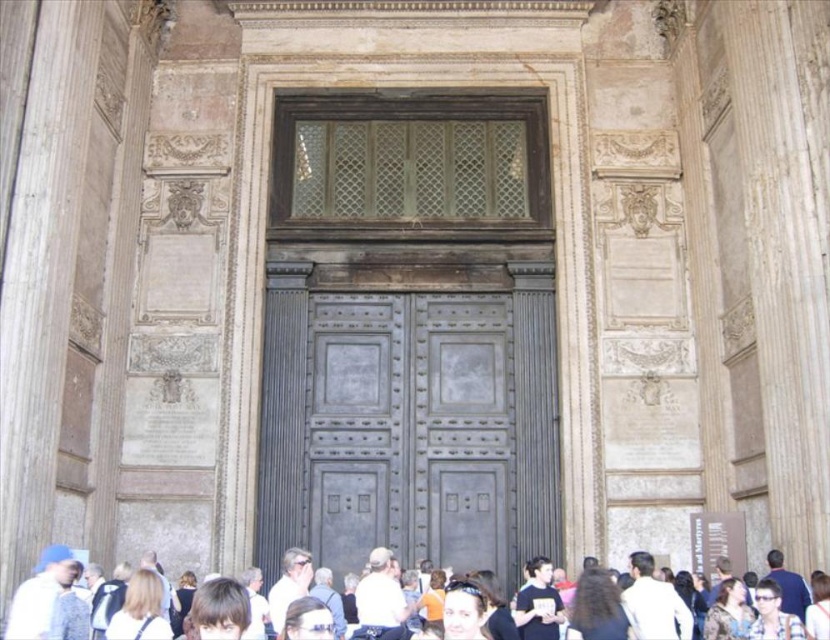
You are standing at the entrance of this historical building and notice a person wearing white casual clothing at lower center and someone with smooth brown hair at center. If you want to take a photo that includes both subjects, which one should you position closer to the camera to ensure they are both in frame?

The white casual clothing at lower center is 6.77 meters away from smooth brown hair at center. To include both in the photo, position the person with smooth brown hair at center closer to the camera since they are nearer to you than the white casual clothing at lower center.

You are standing at the entrance of a building and want to take a photo of the dark gray metal door at center. If your camera has a maximum focus range of 50 meters, will it be able to capture the door clearly?

The dark gray metal door at center is 51.91 meters away from the camera, which exceeds the maximum focus range of 50 meters. Therefore, the camera will not be able to capture the door clearly.

Based on the photo, you are standing at the entrance of the building and want to take a photo of the point at coordinates point [447,529]. Can you estimate how far you need to walk forward to get the point into the center of your camera frame?

The point at coordinates point [447,529] is 173.86 feet away from the camera. To center it in your frame, you would need to walk forward approximately 173.86 feet.